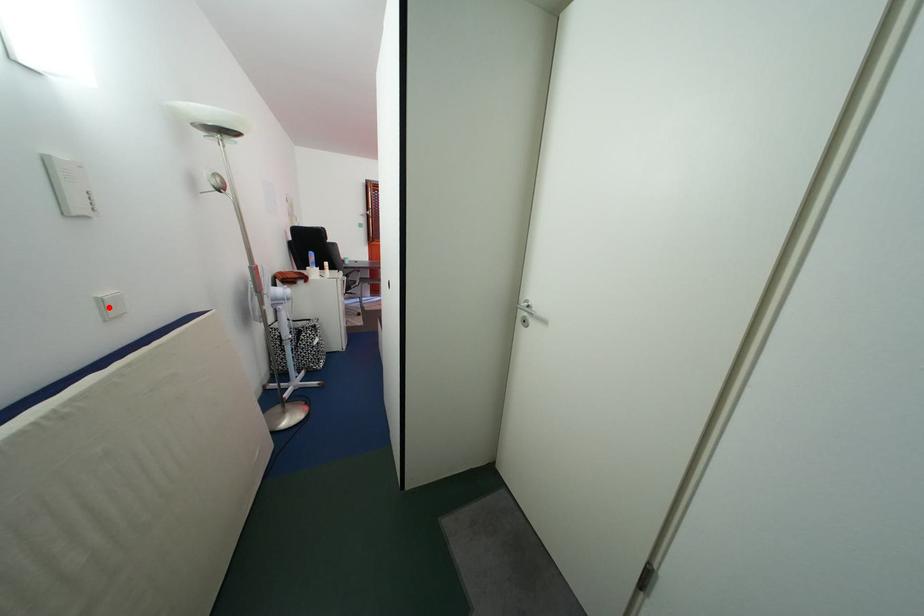
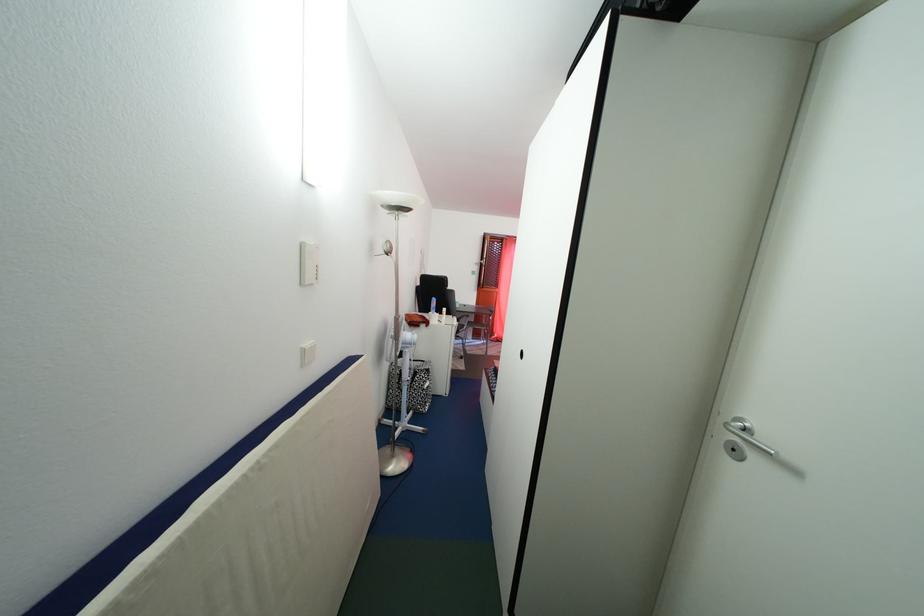
The point at the highlighted location is marked in the first image. Where is the corresponding point in the second image?

(311, 358)